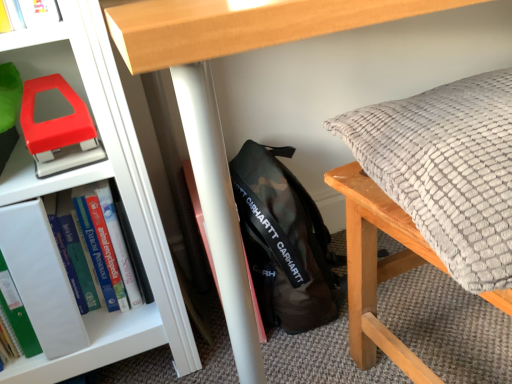
Question: Can we say textured gray pillow at right lies outside camo fabric backpack at center?

Choices:
 (A) yes
 (B) no

Answer: (A)

Question: From a real-world perspective, is textured gray pillow at right positioned under camo fabric backpack at center based on gravity?

Choices:
 (A) no
 (B) yes

Answer: (A)

Question: From the image's perspective, is textured gray pillow at right located beneath camo fabric backpack at center?

Choices:
 (A) no
 (B) yes

Answer: (A)

Question: Is textured gray pillow at right positioned behind camo fabric backpack at center?

Choices:
 (A) no
 (B) yes

Answer: (A)

Question: Could you tell me if textured gray pillow at right is facing camo fabric backpack at center?

Choices:
 (A) no
 (B) yes

Answer: (A)

Question: Visually, is hardcover book at left positioned to the left or to the right of camo fabric backpack at center?

Choices:
 (A) left
 (B) right

Answer: (A)

Question: From a real-world perspective, relative to camo fabric backpack at center, is hardcover book at left vertically above or below?

Choices:
 (A) above
 (B) below

Answer: (A)

Question: In the image, is hardcover book at left positioned in front of or behind camo fabric backpack at center?

Choices:
 (A) front
 (B) behind

Answer: (A)

Question: Looking at the image, does hardcover book at left seem bigger or smaller compared to camo fabric backpack at center?

Choices:
 (A) big
 (B) small

Answer: (B)

Question: From a real-world perspective, is camo fabric backpack at center above or below hardcover book at left?

Choices:
 (A) above
 (B) below

Answer: (B)

Question: Is camo fabric backpack at center spatially inside hardcover book at left, or outside of it?

Choices:
 (A) inside
 (B) outside

Answer: (B)

Question: Considering the positions of point (269, 188) and point (27, 311), is point (269, 188) closer or farther from the camera than point (27, 311)?

Choices:
 (A) farther
 (B) closer

Answer: (A)

Question: In the image, is camo fabric backpack at center positioned in front of or behind hardcover book at left?

Choices:
 (A) behind
 (B) front

Answer: (A)

Question: From a real-world perspective, is textured gray pillow at right positioned above or below hardcover book at left?

Choices:
 (A) above
 (B) below

Answer: (A)

Question: From the image's perspective, is textured gray pillow at right above or below hardcover book at left?

Choices:
 (A) above
 (B) below

Answer: (A)